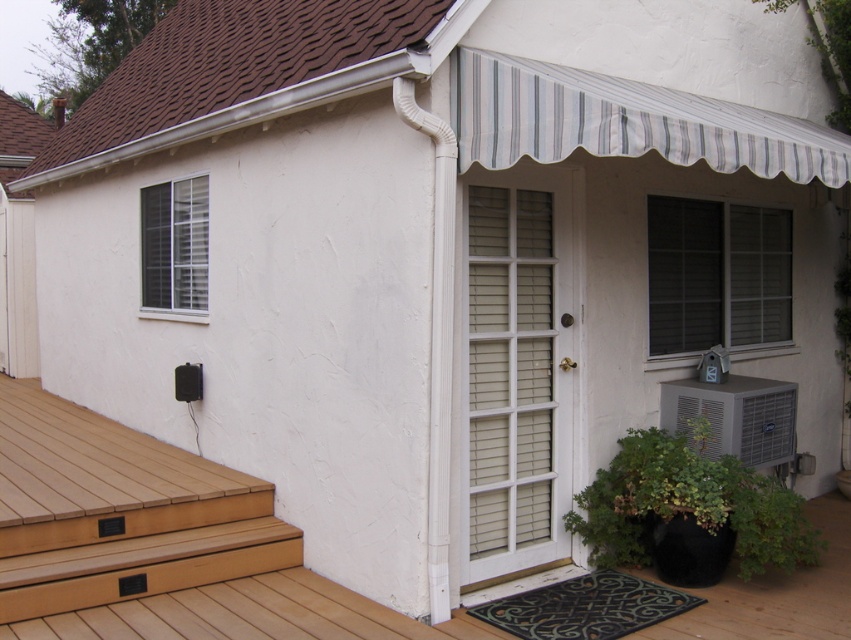
You are a delivery person trying to deliver a package to the house. The package is too large to fit through the door. You notice the white textured shutter at right and the white textured air conditioner at lower right. Which object could potentially be moved to make space for the package?

The white textured shutter at right is larger in size than the white textured air conditioner at lower right, so moving the larger white textured shutter at right might create more space for the package.

You are standing in front of the house and want to enter through the door. There is a white textured screen door at center and a white textured shutter at right. Which object should you approach first to open the door?

You should approach the white textured screen door at center first because it is located to the left of the white textured shutter at right, meaning it is closer to your position in front of the house.